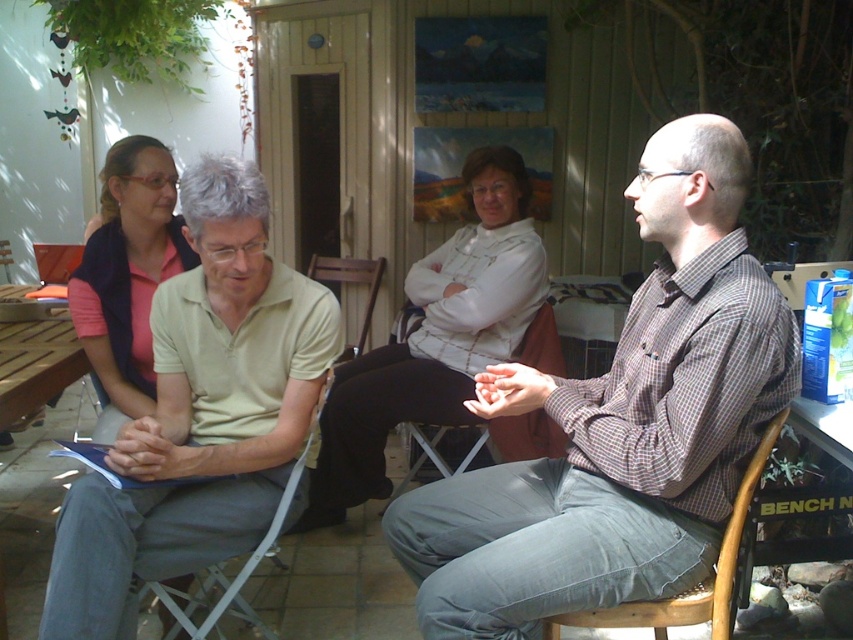
Is point (524, 416) farther from viewer compared to point (183, 602)?

Yes.

Which is more to the right, metallic silver chair at center or metallic gray chair at center?

From the viewer's perspective, metallic silver chair at center appears more on the right side.

Between point (534, 433) and point (294, 468), which one is positioned behind?

Positioned behind is point (534, 433).

Find the location of a particular element. metallic silver chair at center is located at coordinates (491, 442).

Does pink fabric shirt at upper left have a larger size compared to wooden at left?

No, pink fabric shirt at upper left is not bigger than wooden at left.

Image resolution: width=853 pixels, height=640 pixels. Describe the element at coordinates (128, 269) in the screenshot. I see `pink fabric shirt at upper left` at that location.

Describe the element at coordinates (128, 269) in the screenshot. I see `pink fabric shirt at upper left` at that location.

Find the location of a particular element. The width and height of the screenshot is (853, 640). pink fabric shirt at upper left is located at coordinates (128, 269).

Is checkered fabric shirt at center wider than wooden at right?

Indeed, checkered fabric shirt at center has a greater width compared to wooden at right.

Is point (746, 257) behind point (706, 584)?

No, it is in front of (706, 584).

Does point (785, 372) come farther from viewer compared to point (628, 602)?

No.

Identify the location of checkered fabric shirt at center. (619, 424).